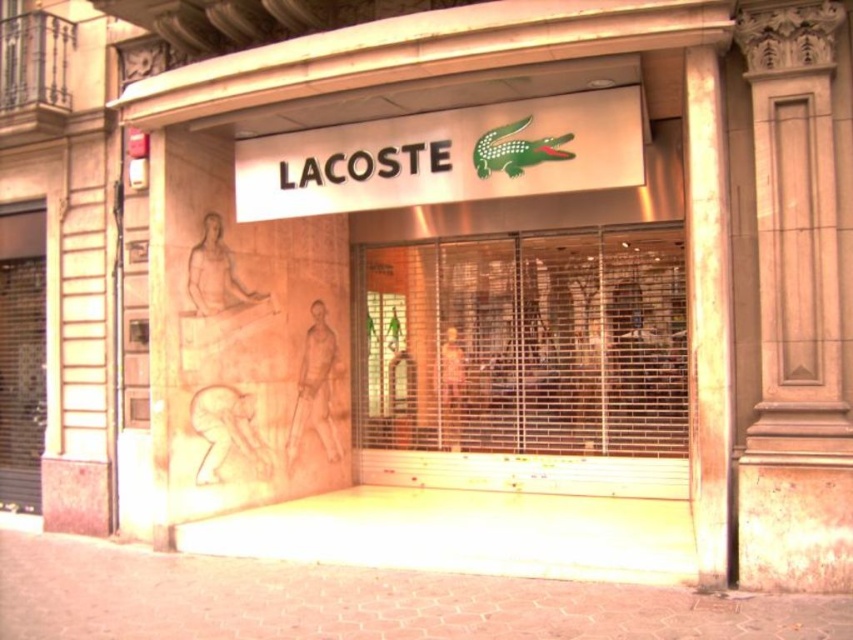
Question: Can you confirm if metallic glass at center is positioned to the right of metallic gate at left?

Choices:
 (A) no
 (B) yes

Answer: (B)

Question: Which object is farther from the camera taking this photo?

Choices:
 (A) metallic gate at left
 (B) metallic glass at center
 (C) smooth stone pillar at right
 (D) white glossy sign at center

Answer: (A)

Question: Can you confirm if metallic glass at center is smaller than smooth stone pillar at right?

Choices:
 (A) yes
 (B) no

Answer: (B)

Question: Considering the real-world distances, which object is farthest from the smooth stone pillar at right?

Choices:
 (A) metallic glass at center
 (B) white glossy sign at center
 (C) metallic gate at left

Answer: (C)

Question: Among these points, which one is farthest from the camera?

Choices:
 (A) (x=30, y=288)
 (B) (x=602, y=413)

Answer: (A)

Question: Does metallic glass at center have a lesser width compared to white glossy sign at center?

Choices:
 (A) no
 (B) yes

Answer: (B)